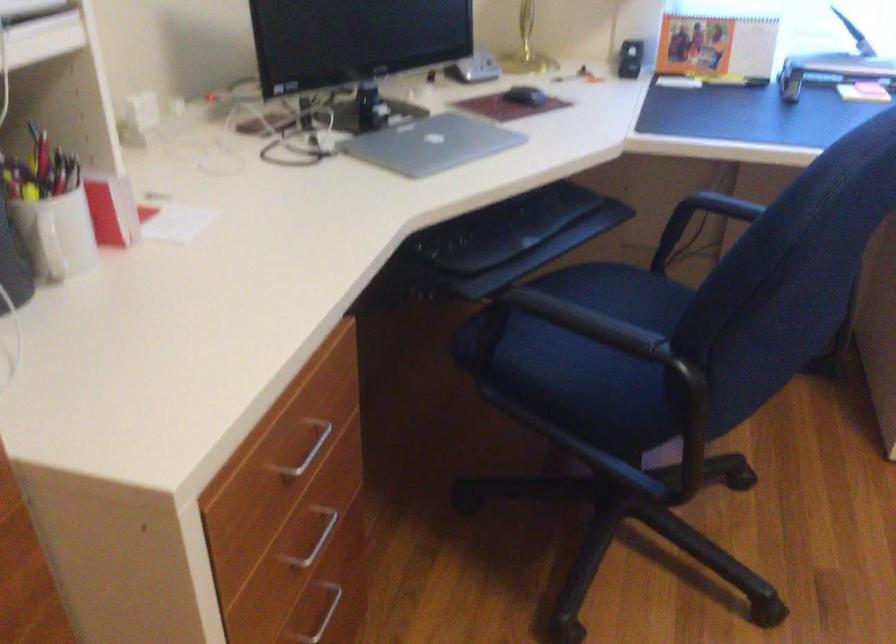
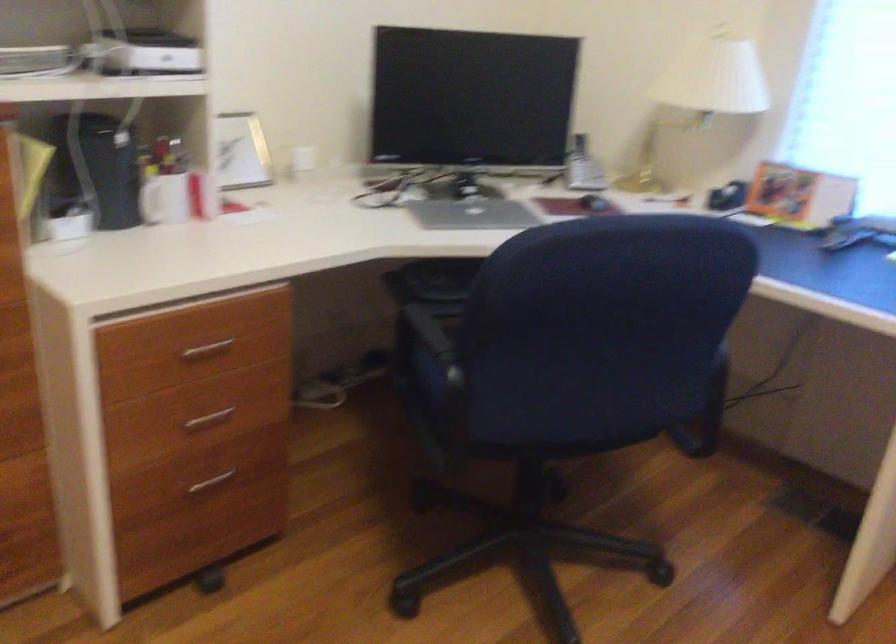
Question: Based on the continuous images, in which direction is the camera rotating? Reply with the corresponding letter.

Choices:
 (A) Left
 (B) Right
 (C) Up
 (D) Down

Answer: (A)